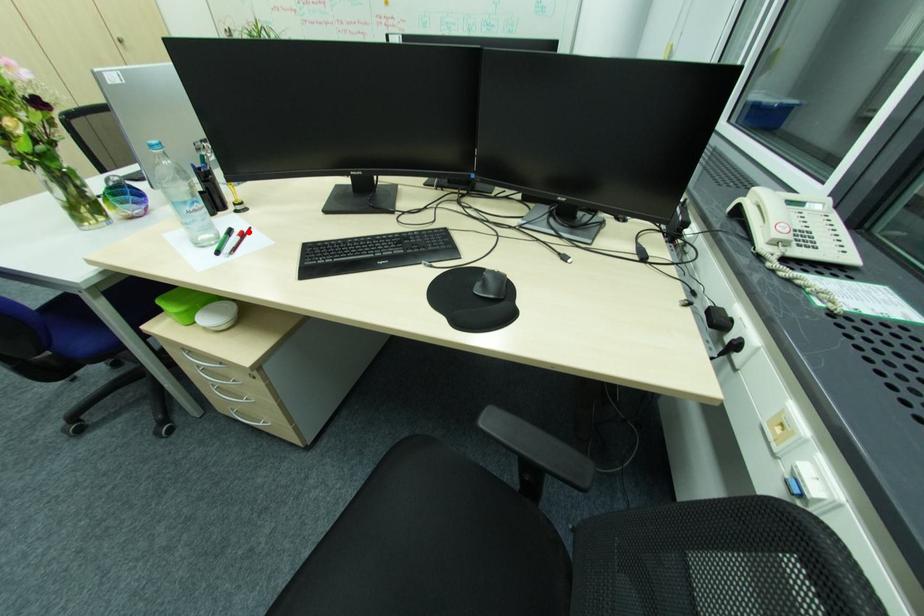
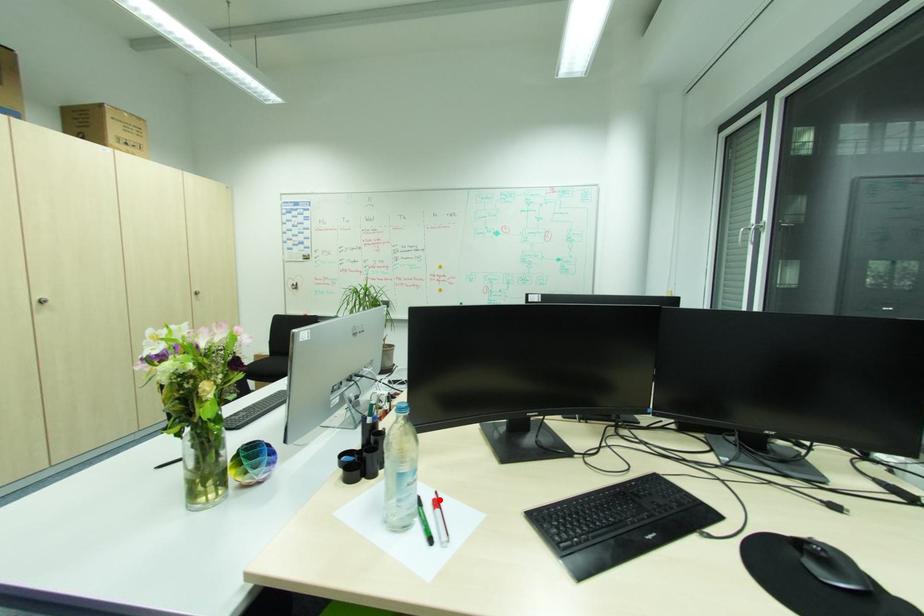
I am providing you with two images of the same scene from different viewpoints. A red point is marked on the first image and another point is marked on the second image. Do the highlighted points in image1 and image2 indicate the same real-world spot?

Yes